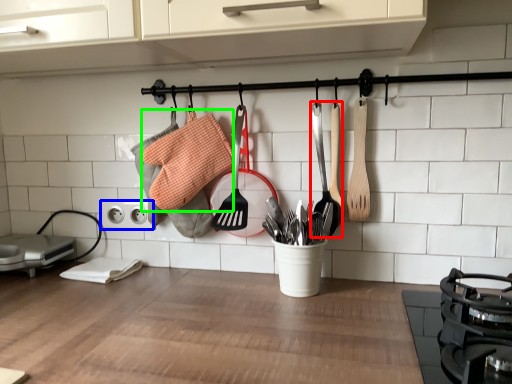
Question: Considering the real-world distances, which object is closest to spatula (highlighted by a red box)? electric outlet (highlighted by a blue box) or material (highlighted by a green box).

Choices:
 (A) electric outlet
 (B) material

Answer: (B)